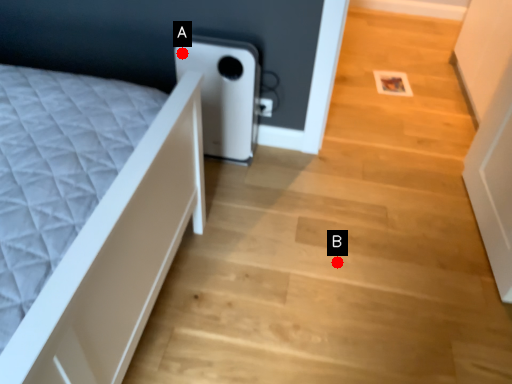
Question: Two points are circled on the image, labeled by A and B beside each circle. Which of the following is the farthest from the observer?

Choices:
 (A) A is further
 (B) B is further

Answer: (B)